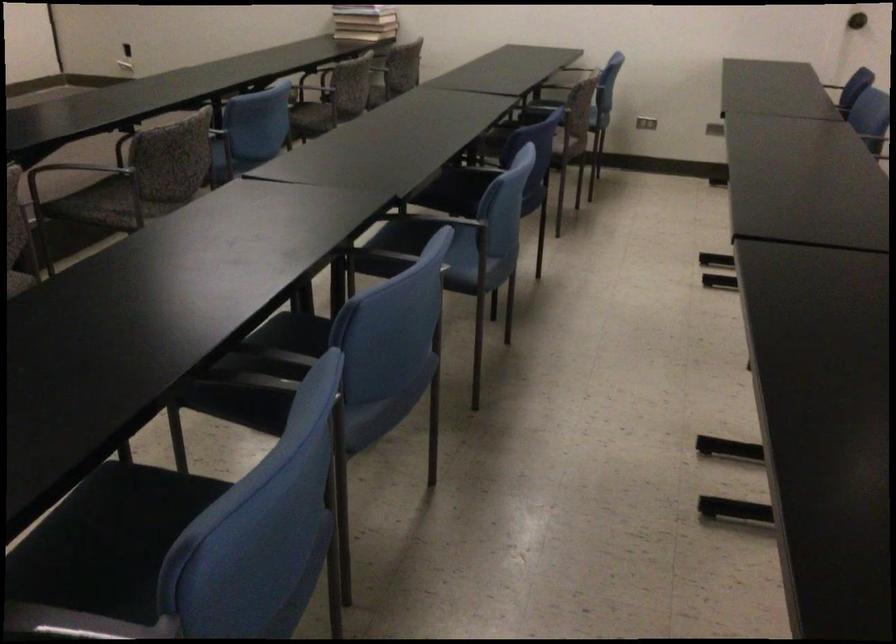
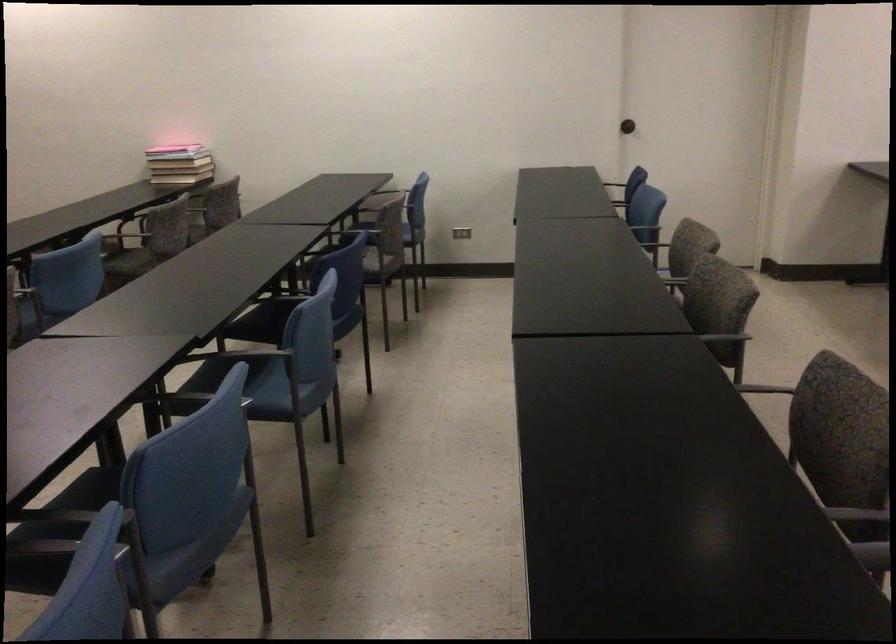
Find the pixel in the second image that matches the point at 464,251 in the first image.

(281, 382)